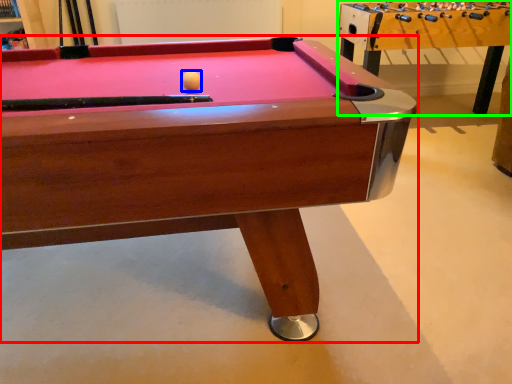
Question: Which object is the closest to the billiard table (highlighted by a red box)? Choose among these: ball (highlighted by a blue box) or table (highlighted by a green box).

Choices:
 (A) ball
 (B) table

Answer: (A)